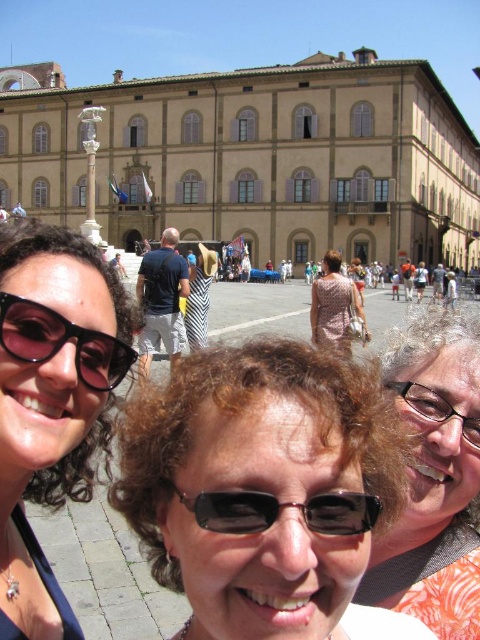
You are a photographer standing in the European square scene. You notice a point marked at coordinates (52,396). What object is located at that point?

The point at (52,396) marks the location of the matte black sunglasses at lower left.

You are a photographer trying to capture a closeup of the printed fabric dress at center. You notice the matte black sunglasses at lower left might be in the way. Based on their positions, can you determine if the sunglasses are blocking the view of the dress?

The matte black sunglasses at lower left is located below the printed fabric dress at center, so it is not blocking the view of the dress since it is positioned lower down.

Looking at this image, you are an architect visiting the square and need to take a photo of the beige stone building at center and the striped fabric at center. Since you want both to be clearly visible in the frame, which object should you focus on first to ensure proper depth of field?

The beige stone building at center is larger than the striped fabric at center, so focusing on the larger beige stone building at center first will ensure both are in focus as depth of field typically extends further behind the point of focus than in front.